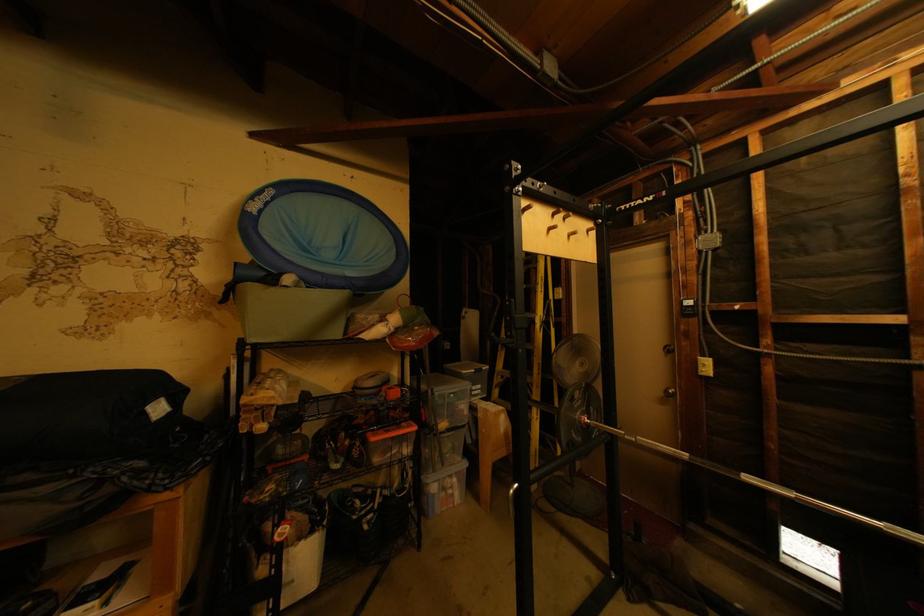
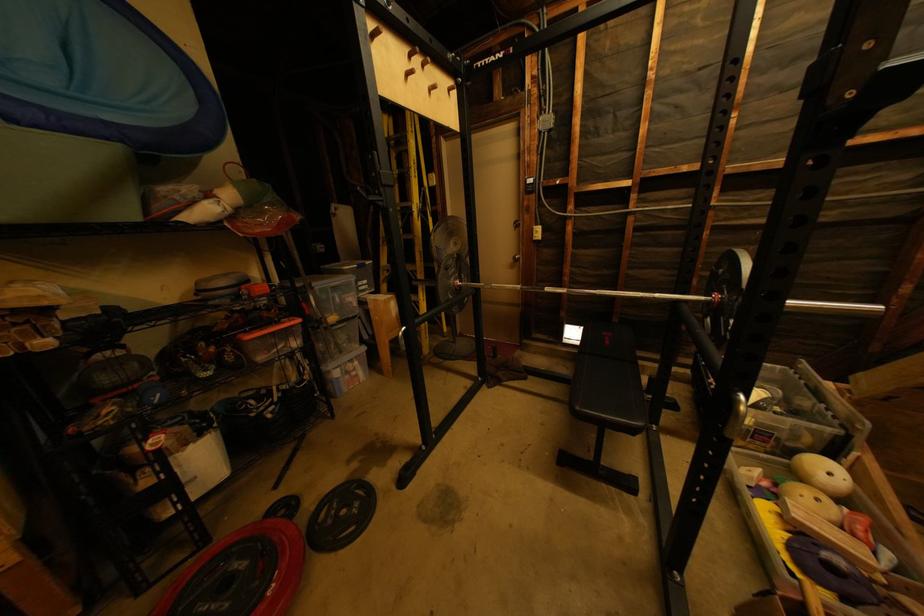
The first image is from the beginning of the video and the second image is from the end. How did the camera likely rotate when shooting the video?

The camera rotated toward right-down.